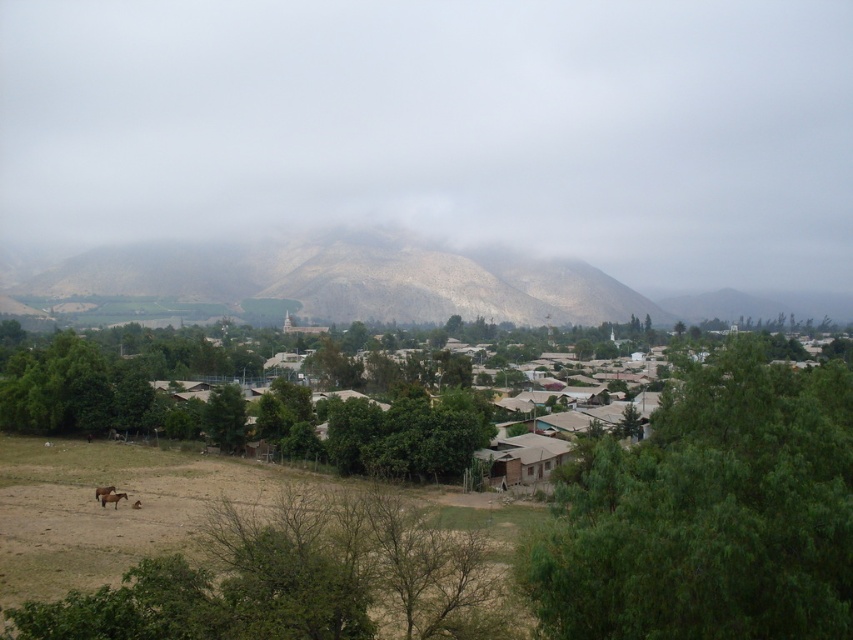
Question: Estimate the real-world distances between objects in this image. Which object is closer to the brown fuzzy horse at lower left?

Choices:
 (A) green leafy tree at center right
 (B) brown matte horse at lower left
 (C) brown corrugated metal hut at lower right

Answer: (B)

Question: Which of the following is the closest to the observer?

Choices:
 (A) green matte tree at center
 (B) brown corrugated metal hut at lower right
 (C) brown fuzzy horse at lower left

Answer: (C)

Question: Is green matte tree at center smaller than brown matte horse at lower left?

Choices:
 (A) yes
 (B) no

Answer: (B)

Question: Does green leafy tree at center right appear on the right side of desert-like brown mountain at center?

Choices:
 (A) yes
 (B) no

Answer: (A)

Question: Does green leafy tree at center right come in front of brown fuzzy horse at lower left?

Choices:
 (A) no
 (B) yes

Answer: (B)

Question: Which of the following is the farthest from the observer?

Choices:
 (A) brown fuzzy horse at lower left
 (B) desert-like brown mountain at center
 (C) brown corrugated metal hut at lower right

Answer: (B)